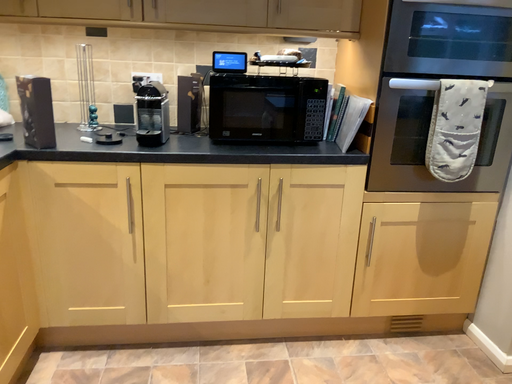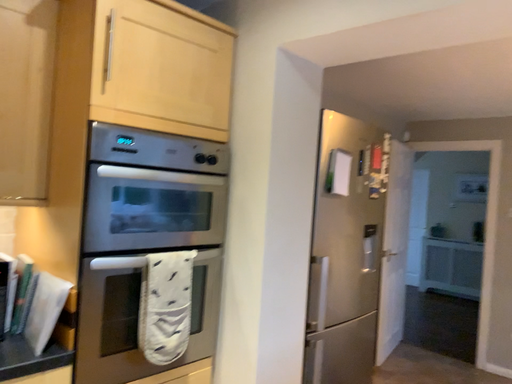
Question: Which way did the camera rotate in the video?

Choices:
 (A) rotated upward
 (B) rotated downward

Answer: (A)